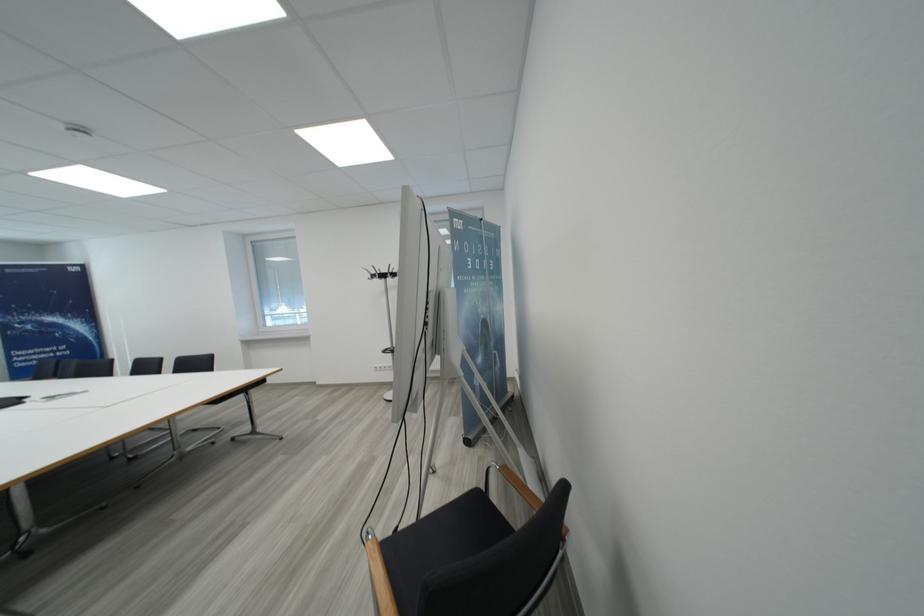
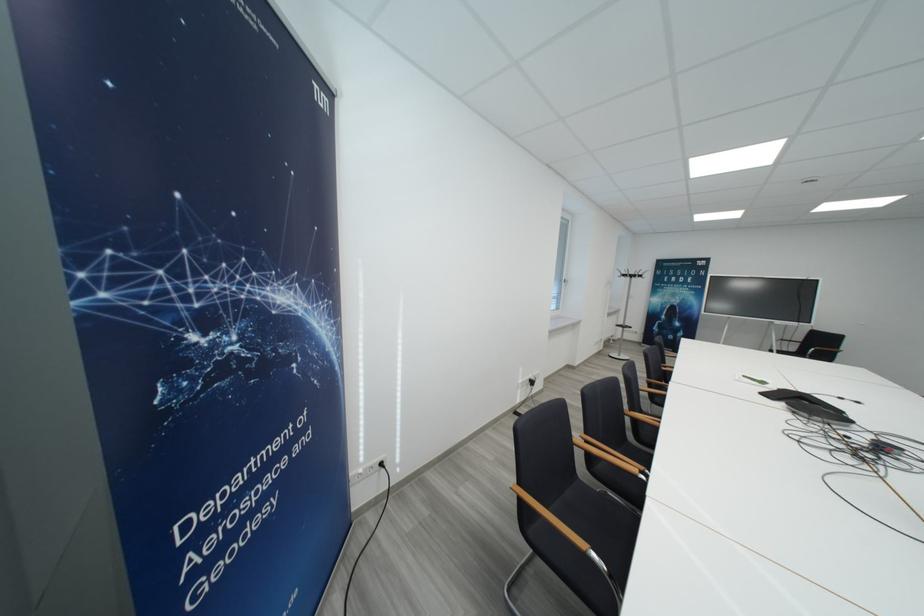
Question: I am providing you with two images of the same scene from different viewpoints. Which of the following objects are not visible in image2?

Choices:
 (A) wooden chair armrest
 (B) black conference phone
 (C) long silver handle
 (D) black chair sitting surface

Answer: (D)